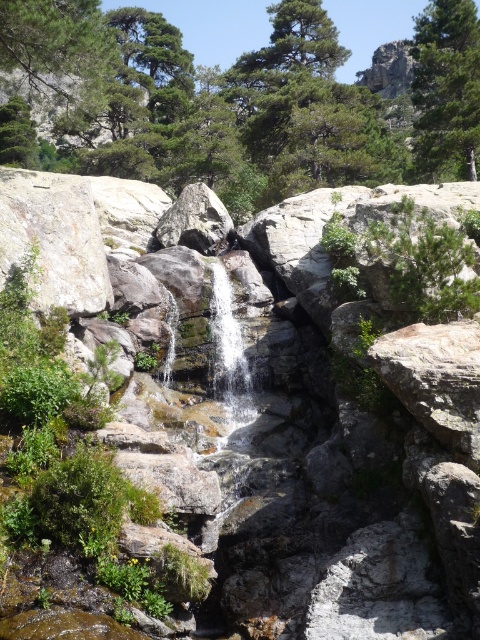
You are standing near the waterfall and want to take a photo of both the green leafy tree at upper center and the clear water at center. Which object should you focus on first to ensure both are in the frame?

You should focus on the green leafy tree at upper center first because it is closer to you than the clear water at center, so adjusting the camera to capture it ensures the clear water at center will also be in view.

You are standing near the waterfall and want to place a small potted plant between the smooth gray rock at center and the clear water at center. Based on their positions, which object should the plant be closer to?

The smooth gray rock at center is positioned on the right side of clear water at center, so the plant should be placed closer to the smooth gray rock at center to be between them.

You are standing at the base of the waterfall and want to reach the green leafy tree at upper center. Which direction should you move relative to the smooth gray rock at center?

You should move to the right of the smooth gray rock at center to reach the green leafy tree at upper center since the tree is to the right of the rock.